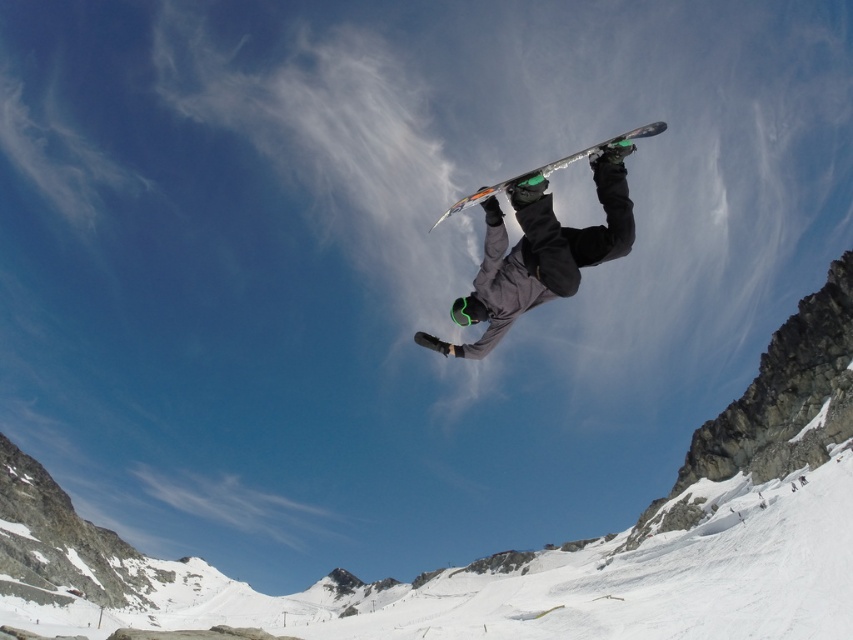
Is matte black snowboarder at center closer to the viewer compared to shiny metallic snowboard at center?

Yes, it is in front of shiny metallic snowboard at center.

Who is positioned more to the left, matte black snowboarder at center or shiny metallic snowboard at center?

From the viewer's perspective, matte black snowboarder at center appears more on the left side.

Does point (611, 186) come in front of point (660, 122)?

Yes, point (611, 186) is in front of point (660, 122).

Where is `matte black snowboarder at center`? This screenshot has width=853, height=640. matte black snowboarder at center is located at coordinates (538, 252).